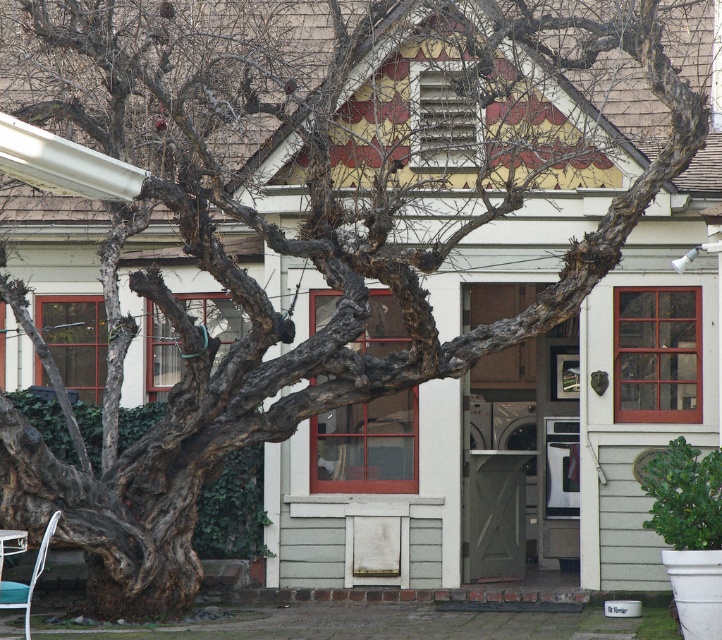
Question: Can you confirm if dark brown rough bark at lower left is positioned to the right of metallic white chair at lower left?

Choices:
 (A) no
 (B) yes

Answer: (B)

Question: Which point is closer to the camera taking this photo?

Choices:
 (A) (32, 573)
 (B) (183, 544)

Answer: (B)

Question: Can you confirm if dark brown rough bark at lower left is positioned above metallic white chair at lower left?

Choices:
 (A) yes
 (B) no

Answer: (A)

Question: From the image, what is the correct spatial relationship of dark brown rough bark at lower left in relation to metallic white chair at lower left?

Choices:
 (A) right
 (B) left

Answer: (A)

Question: Among these points, which one is nearest to the camera?

Choices:
 (A) (27, 632)
 (B) (53, 488)

Answer: (A)

Question: Among these objects, which one is nearest to the camera?

Choices:
 (A) metallic white chair at lower left
 (B) dark brown rough bark at lower left

Answer: (A)